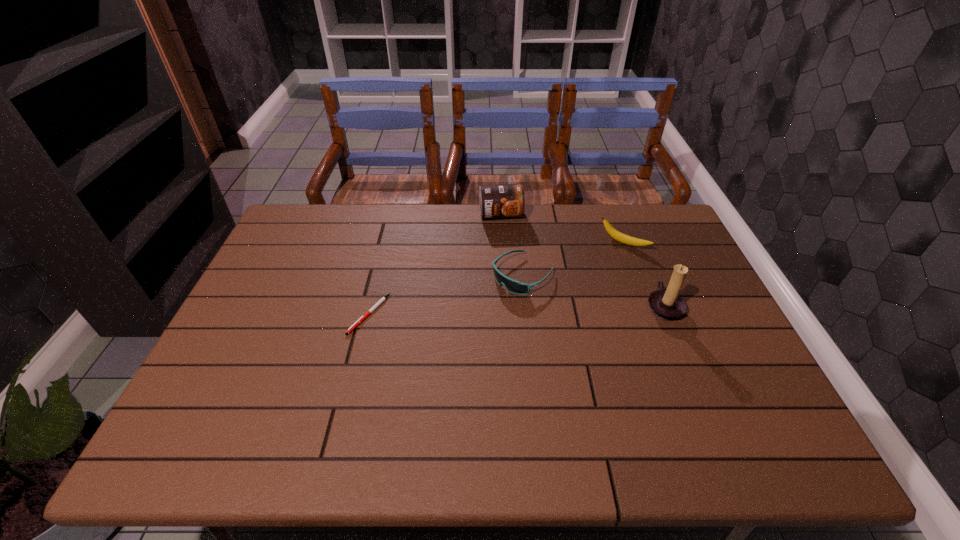
Locate an element on the screen. The image size is (960, 540). vacant space located 0.160m on the upward curve of the banana is located at coordinates (587, 278).

You are a GUI agent. You are given a task and a screenshot of the screen. Output one action in this format:
    pyautogui.click(x=<x>, y=<y>)
    Task: Click on the vacant space located on the upward curve of the banana
    This screenshot has width=960, height=540.
    Given the screenshot: What is the action you would take?
    pyautogui.click(x=605, y=260)

Locate an element on the screen. This screenshot has width=960, height=540. vacant position located 0.210m on the front-facing side of the sunglasses is located at coordinates (448, 330).

You are a GUI agent. You are given a task and a screenshot of the screen. Output one action in this format:
    pyautogui.click(x=<x>, y=<y>)
    Task: Click on the vacant region located 0.290m on the front-facing side of the sunglasses
    The height and width of the screenshot is (540, 960).
    Given the screenshot: What is the action you would take?
    pyautogui.click(x=425, y=348)

The width and height of the screenshot is (960, 540). I want to click on vacant area located on the front-facing side of the sunglasses, so (x=491, y=299).

The width and height of the screenshot is (960, 540). Identify the location of free space located on the front label of the farthest object. (516, 284).

Where is `vacant region located 0.300m on the front label of the farthest object`? Image resolution: width=960 pixels, height=540 pixels. vacant region located 0.300m on the front label of the farthest object is located at coordinates (516, 286).

At what (x,y) coordinates should I click in order to perform the action: click on free location located on the front label of the farthest object. Please return your answer as a coordinate pair (x, y). Looking at the image, I should click on (520, 301).

The width and height of the screenshot is (960, 540). I want to click on banana present at the far edge, so click(x=616, y=235).

At what (x,y) coordinates should I click in order to perform the action: click on can at the far edge. Please return your answer as a coordinate pair (x, y). Image resolution: width=960 pixels, height=540 pixels. Looking at the image, I should click on (505, 200).